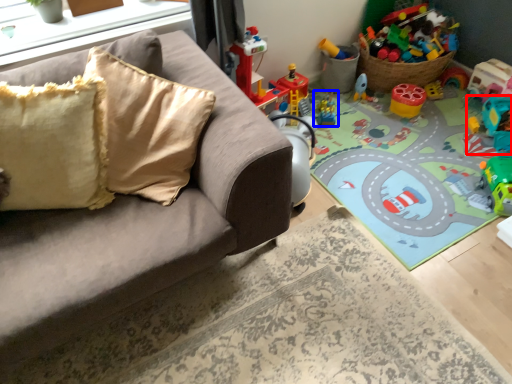
Question: Which object is closer to the camera taking this photo, toy (highlighted by a red box) or toy (highlighted by a blue box)?

Choices:
 (A) toy
 (B) toy

Answer: (A)